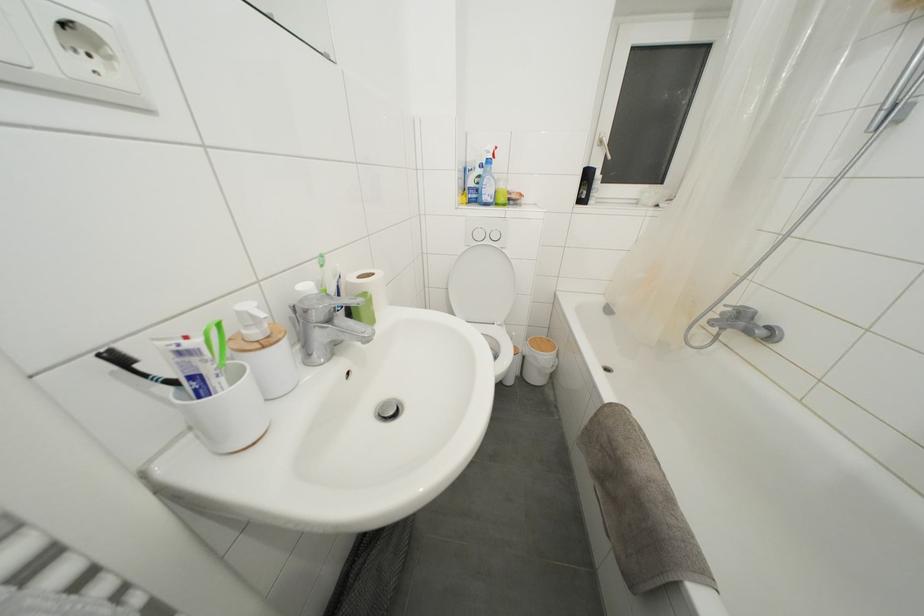
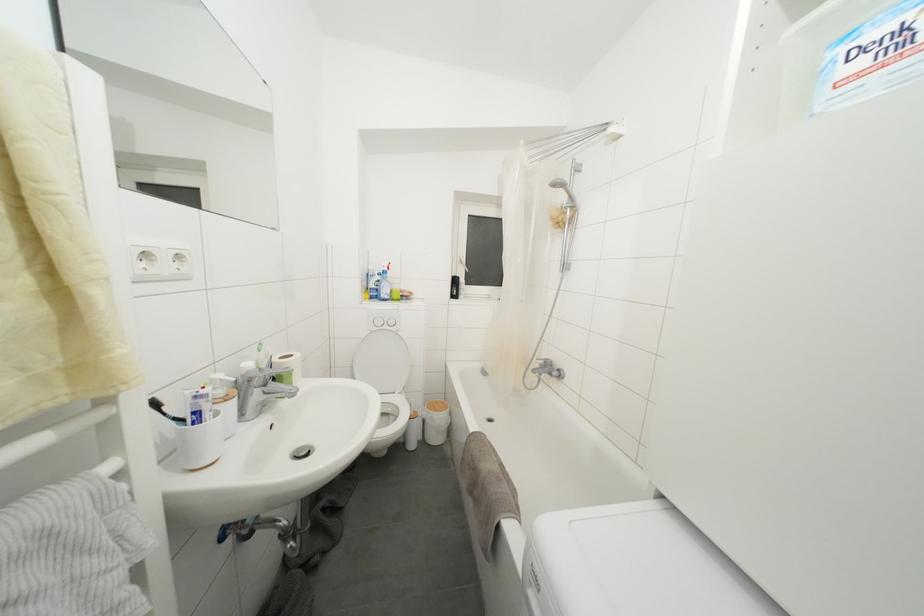
In the second image, find the point that corresponds to point (619, 408) in the first image.

(480, 438)